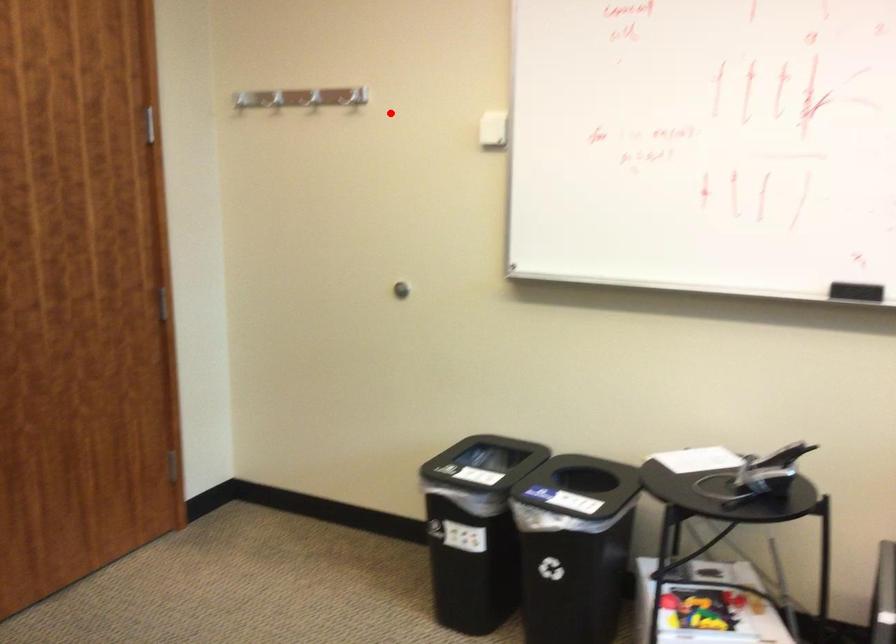
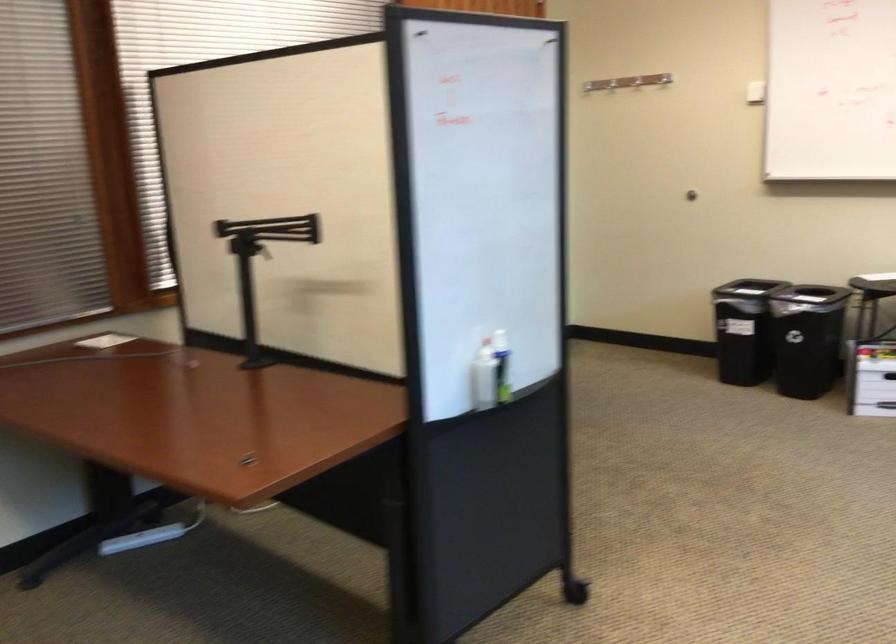
The point at the highlighted location is marked in the first image. Where is the corresponding point in the second image?

(610, 84)